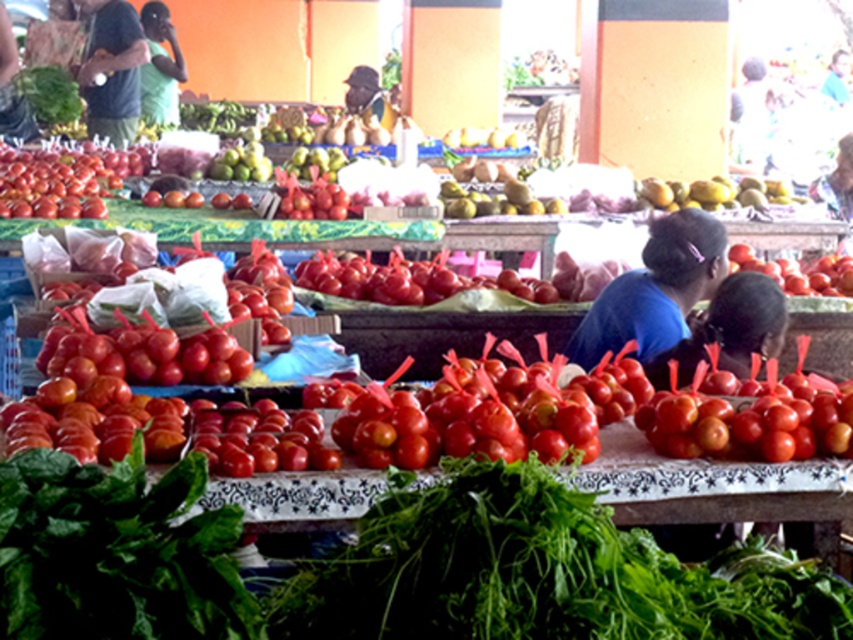
Question: Is blue fabric at center thinner than smooth green leafy vegetable at upper left?

Choices:
 (A) no
 (B) yes

Answer: (A)

Question: Is smooth blue shirt at center above matte black shirt at upper left?

Choices:
 (A) yes
 (B) no

Answer: (B)

Question: Which of the following is the farthest from the observer?

Choices:
 (A) (643, 314)
 (B) (61, 92)
 (C) (19, 632)

Answer: (B)

Question: Which of the following is the closest to the observer?

Choices:
 (A) smooth green leafy vegetable at upper left
 (B) matte black shirt at upper left
 (C) green leafy at lower left
 (D) green matte shirt at upper left

Answer: (C)

Question: Does smooth blue shirt at center have a greater width compared to smooth green leafy vegetable at upper left?

Choices:
 (A) no
 (B) yes

Answer: (A)

Question: Which of these objects is positioned closest to the green leafy at center?

Choices:
 (A) smooth green leafy vegetable at upper left
 (B) matte black shirt at upper left
 (C) dark blue shirt at upper left
 (D) dark brown hat at upper center

Answer: (B)